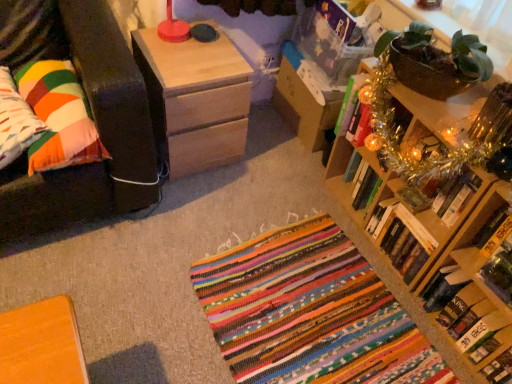
The width and height of the screenshot is (512, 384). What are the coordinates of `free point above multicolored fabric pillow at left, which appears as the first pillow when viewed from the right (from a real-world perspective)` in the screenshot? It's located at (52, 94).